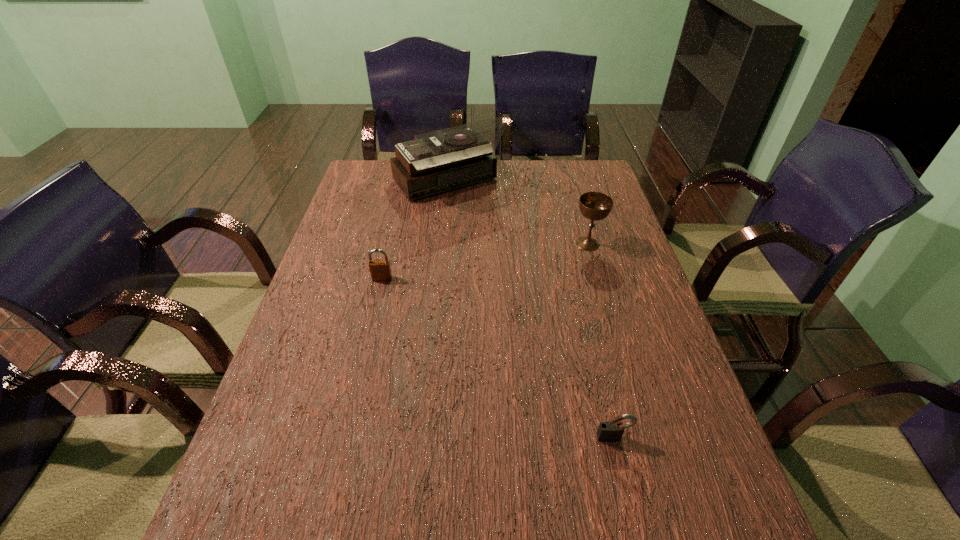
This screenshot has height=540, width=960. Identify the location of vacant area that lies between the shortest object and the tallest object. (530, 311).

At what (x,y) coordinates should I click in order to perform the action: click on free space between the nearer padlock and the farther padlock. Please return your answer as a coordinate pair (x, y). The width and height of the screenshot is (960, 540). Looking at the image, I should click on (497, 358).

Identify the location of vacant space in between the second farthest object and the tallest object. (517, 214).

Select which object is the closest to the farthest object. Please provide its 2D coordinates. Your answer should be formatted as a tuple, i.e. [(x, y)], where the tuple contains the x and y coordinates of a point satisfying the conditions above.

[(595, 206)]

Locate an element on the screen. object that can be found as the third closest to the tallest object is located at coordinates (611, 431).